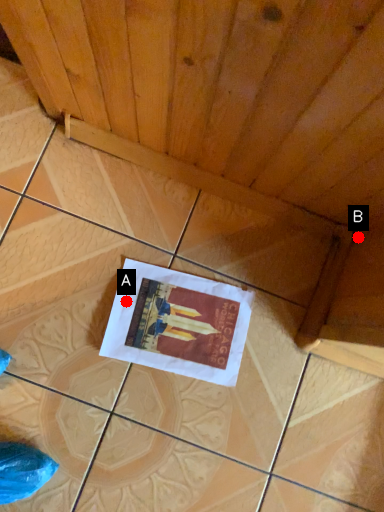
Question: Two points are circled on the image, labeled by A and B beside each circle. Among these points, which one is nearest to the camera?

Choices:
 (A) A is closer
 (B) B is closer

Answer: (B)